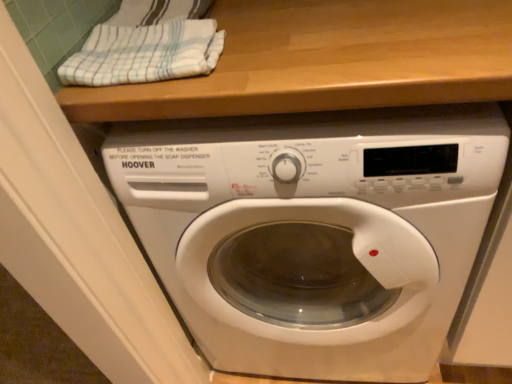
Question: Considering their positions, is white striped towel at upper left located in front of or behind white glossy washing machine at center?

Choices:
 (A) front
 (B) behind

Answer: (B)

Question: From a real-world perspective, is white striped towel at upper left physically located above or below white glossy washing machine at center?

Choices:
 (A) above
 (B) below

Answer: (A)

Question: In terms of size, does white striped towel at upper left appear bigger or smaller than white glossy washing machine at center?

Choices:
 (A) big
 (B) small

Answer: (B)

Question: From a real-world perspective, relative to white striped towel at upper left, is white glossy washing machine at center vertically above or below?

Choices:
 (A) below
 (B) above

Answer: (A)

Question: Which is correct: white glossy washing machine at center is inside white striped towel at upper left, or outside of it?

Choices:
 (A) inside
 (B) outside

Answer: (B)

Question: Relative to white striped towel at upper left, is white glossy washing machine at center in front or behind?

Choices:
 (A) front
 (B) behind

Answer: (A)

Question: Considering the positions of white glossy washing machine at center and white striped towel at upper left in the image, is white glossy washing machine at center wider or thinner than white striped towel at upper left?

Choices:
 (A) wide
 (B) thin

Answer: (A)